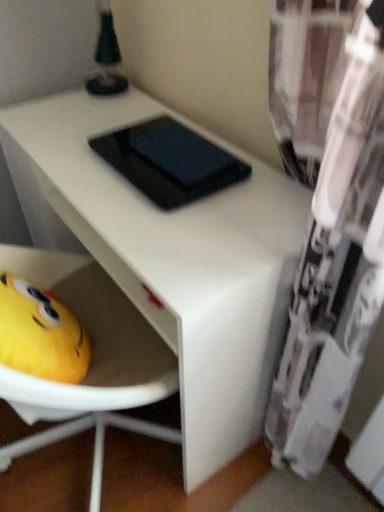
Question: Considering the relative positions of white matte table at center and black matte pad at center in the image provided, is white matte table at center to the left of black matte pad at center from the viewer's perspective?

Choices:
 (A) no
 (B) yes

Answer: (B)

Question: From a real-world perspective, is white matte table at center beneath black matte pad at center?

Choices:
 (A) yes
 (B) no

Answer: (A)

Question: Is black matte pad at center located within white matte table at center?

Choices:
 (A) no
 (B) yes

Answer: (A)

Question: Would you say white matte table at center is outside black matte pad at center?

Choices:
 (A) yes
 (B) no

Answer: (A)

Question: Can you confirm if white matte table at center is wider than black matte pad at center?

Choices:
 (A) yes
 (B) no

Answer: (A)

Question: Does white matte table at center lie behind black matte pad at center?

Choices:
 (A) yes
 (B) no

Answer: (B)

Question: From a real-world perspective, is black matte pad at center over white matte table at center?

Choices:
 (A) yes
 (B) no

Answer: (A)

Question: From the image's perspective, does black matte pad at center appear lower than white matte table at center?

Choices:
 (A) no
 (B) yes

Answer: (A)

Question: Is the surface of black matte pad at center in direct contact with white matte table at center?

Choices:
 (A) no
 (B) yes

Answer: (A)

Question: Does black matte pad at center have a lesser width compared to white matte table at center?

Choices:
 (A) no
 (B) yes

Answer: (B)

Question: Can you confirm if black matte pad at center is positioned to the right of white matte table at center?

Choices:
 (A) yes
 (B) no

Answer: (A)

Question: From a real-world perspective, does black matte pad at center sit lower than white matte table at center?

Choices:
 (A) yes
 (B) no

Answer: (B)

Question: Is white matte table at center inside or outside of black matte pad at center?

Choices:
 (A) outside
 (B) inside

Answer: (A)